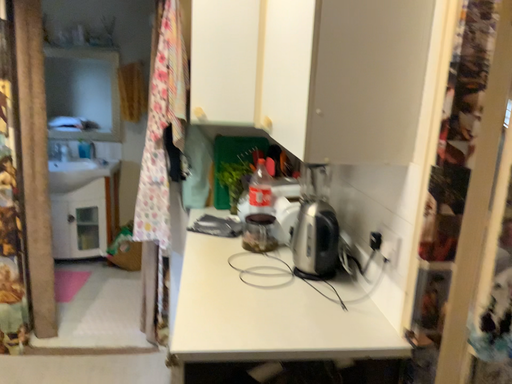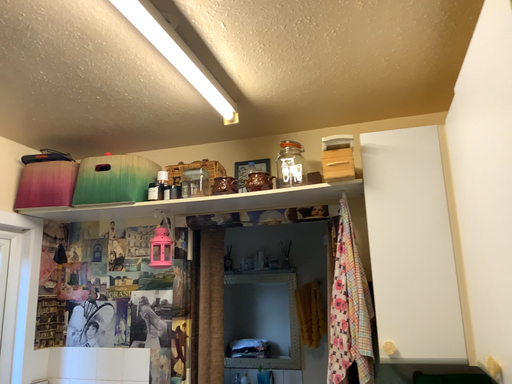
Question: How did the camera likely rotate when shooting the video?

Choices:
 (A) rotated upward
 (B) rotated downward

Answer: (A)